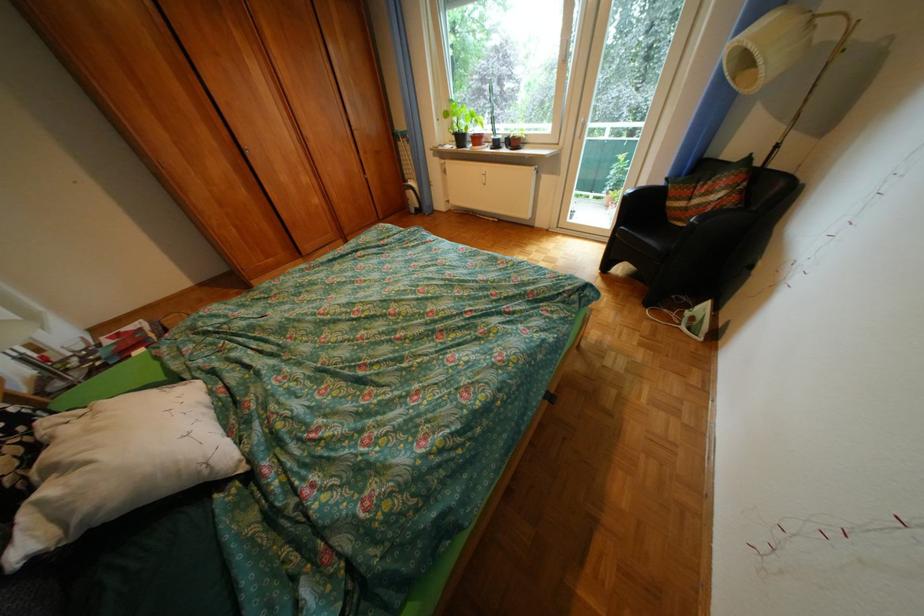
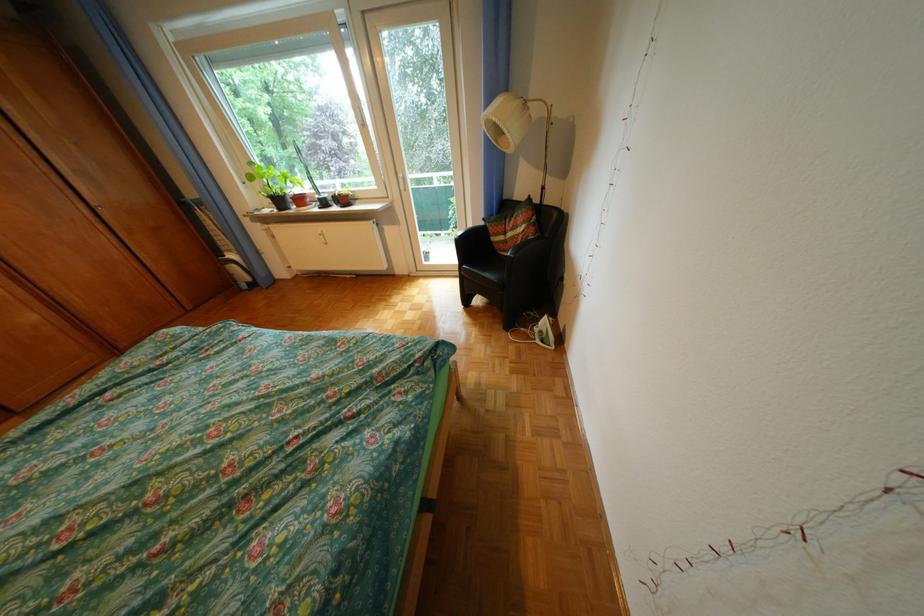
Question: In a continuous first-person perspective shot, in which direction is the camera moving?

Choices:
 (A) Left
 (B) Right
 (C) Forward
 (D) Backward

Answer: (B)